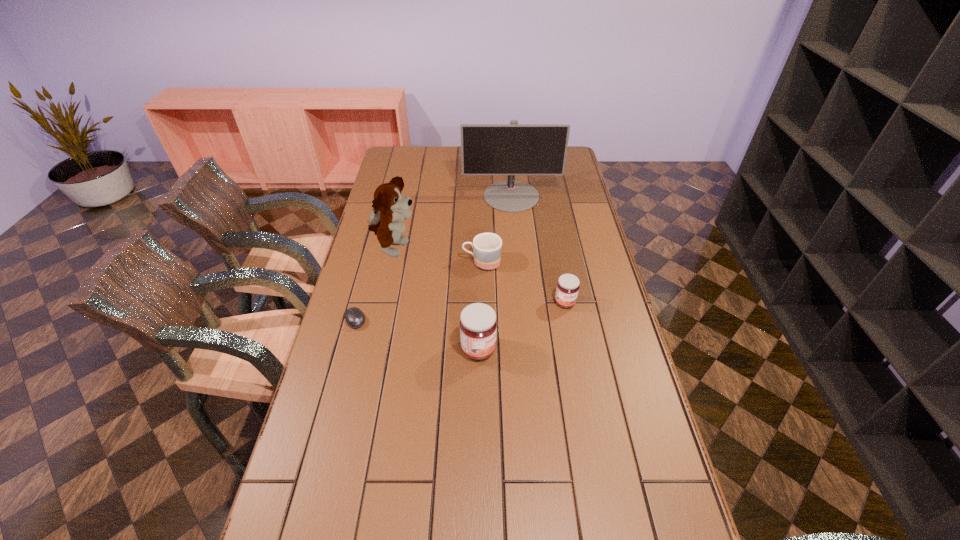
Given the evenly spaced jams in the image, where should an extra jam be added on the left to preserve the spacing? Please point to a vacant space. Please provide its 2D coordinates. Your answer should be formatted as a tuple, i.e. [(x, y)], where the tuple contains the x and y coordinates of a point satisfying the conditions above.

[(372, 407)]